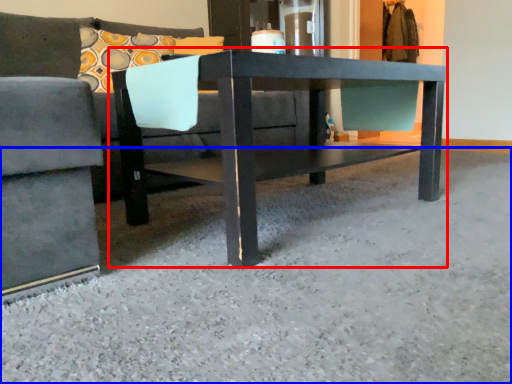
Question: Which object appears farthest to the camera in this image, table (highlighted by a red box) or concrete (highlighted by a blue box)?

Choices:
 (A) table
 (B) concrete

Answer: (A)